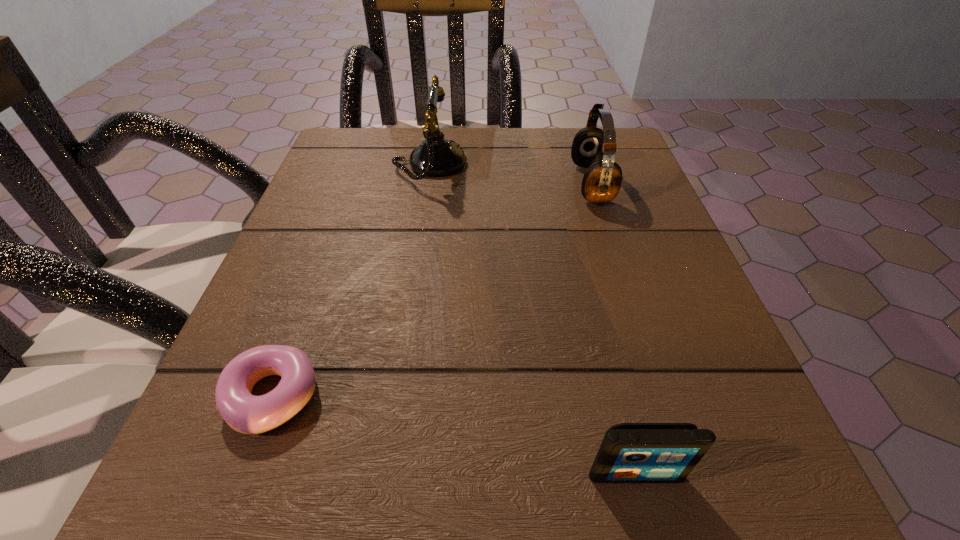
The height and width of the screenshot is (540, 960). I want to click on object located at the near right corner, so click(x=630, y=452).

This screenshot has width=960, height=540. In the image, there is a desktop. What are the coordinates of `vacant space at the far edge` in the screenshot? It's located at (505, 147).

Find the location of `free space at the near edge of the desktop`. free space at the near edge of the desktop is located at coordinates (370, 468).

Identify the location of free region at the left edge of the desktop. This screenshot has height=540, width=960. (344, 214).

Where is `free space at the right edge of the desktop`? The height and width of the screenshot is (540, 960). free space at the right edge of the desktop is located at coordinates pyautogui.click(x=631, y=213).

Where is `vacant space at the far left corner of the desktop`? Image resolution: width=960 pixels, height=540 pixels. vacant space at the far left corner of the desktop is located at coordinates (353, 164).

At what (x,y) coordinates should I click in order to perform the action: click on free space between the headset and the third object from right to left. Please return your answer as a coordinate pair (x, y). This screenshot has height=540, width=960. Looking at the image, I should click on (511, 174).

Find the location of a particular element. free space between the third tallest object and the third farthest object is located at coordinates (454, 435).

This screenshot has height=540, width=960. In order to click on empty location between the telephone and the second shortest object in this screenshot , I will do `click(533, 319)`.

This screenshot has height=540, width=960. In order to click on vacant area between the headset and the iPod in this screenshot , I will do `click(613, 328)`.